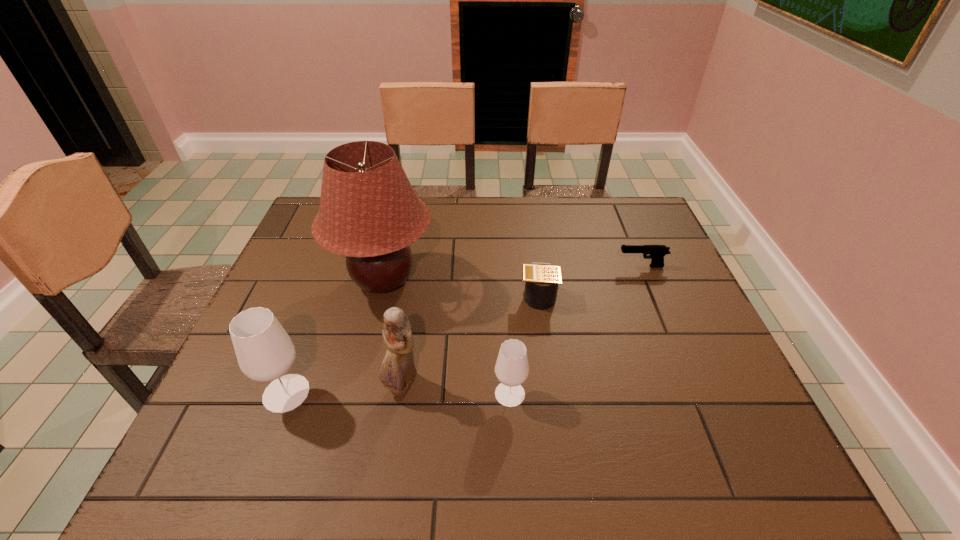
Where is `free space located 0.070m on the front-facing side of the rightmost object`? The height and width of the screenshot is (540, 960). free space located 0.070m on the front-facing side of the rightmost object is located at coordinates (592, 266).

Identify the location of vacant space situated 0.120m on the front-facing side of the rightmost object. The width and height of the screenshot is (960, 540). (575, 266).

Find the location of a particular element. vacant area situated 0.160m on the front-facing side of the rightmost object is located at coordinates (561, 266).

Locate an element on the screen. free location located on the right of the calculator is located at coordinates (675, 295).

At what (x,y) coordinates should I click in order to perform the action: click on vacant space located on the front-facing side of the tallest object. Please return your answer as a coordinate pair (x, y). Looking at the image, I should click on (491, 280).

The height and width of the screenshot is (540, 960). I want to click on figurine situated at the near edge, so click(398, 371).

Identify the location of glass that is at the left edge. The height and width of the screenshot is (540, 960). (265, 352).

At what (x,y) coordinates should I click in order to perform the action: click on lampshade at the left edge. Please return your answer as a coordinate pair (x, y). Image resolution: width=960 pixels, height=540 pixels. Looking at the image, I should click on (369, 212).

This screenshot has height=540, width=960. What are the coordinates of `object that is positioned at the right edge` in the screenshot? It's located at (657, 252).

Locate an element on the screen. This screenshot has width=960, height=540. object that is positioned at the near left corner is located at coordinates (265, 352).